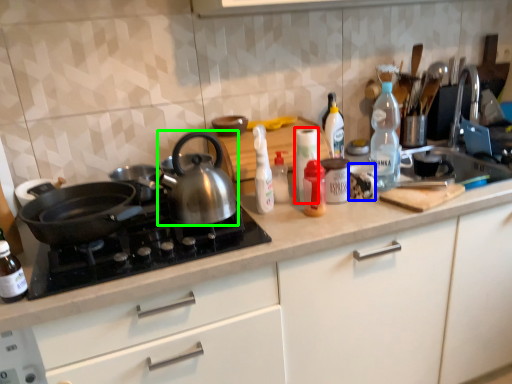
Question: Considering the real-world distances, which object is farthest from bottle (highlighted by a red box)? tableware (highlighted by a blue box) or kettle (highlighted by a green box)?

Choices:
 (A) tableware
 (B) kettle

Answer: (B)